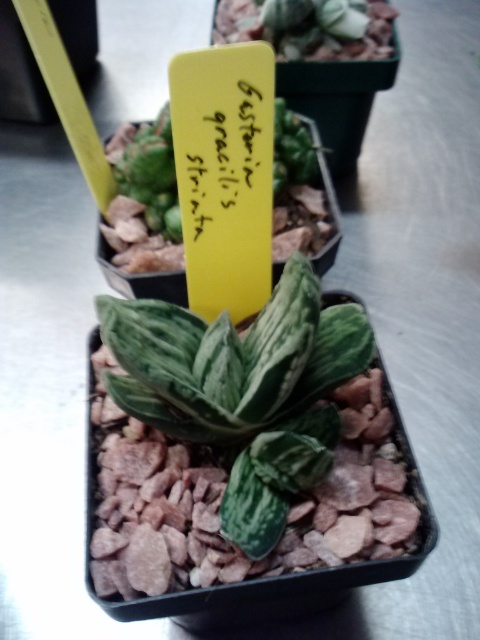
Question: Does yellow paper at center appear over green textured succulent at center?

Choices:
 (A) yes
 (B) no

Answer: (B)

Question: Does green striped succulent at center have a larger size compared to green textured succulent at center?

Choices:
 (A) no
 (B) yes

Answer: (A)

Question: Which point is farther to the camera?

Choices:
 (A) (183, 132)
 (B) (122, 401)
 (C) (324, 211)

Answer: (C)

Question: Can you confirm if green striped succulent at center is bigger than green textured succulent at center?

Choices:
 (A) no
 (B) yes

Answer: (A)

Question: Which of the following is the farthest from the observer?

Choices:
 (A) (261, 220)
 (B) (296, 292)

Answer: (A)

Question: Considering the real-world distances, which object is closest to the green striped succulent at center?

Choices:
 (A) yellow paper at center
 (B) green textured succulent at center

Answer: (A)